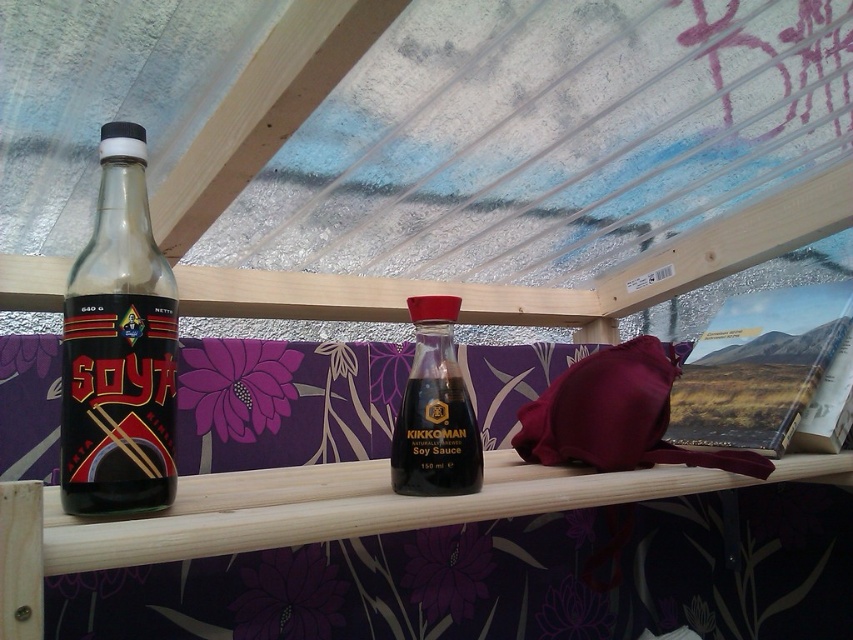
Question: Does matte glass soy sauce bottle at left have a greater width compared to dark brown glass bottle at center?

Choices:
 (A) yes
 (B) no

Answer: (A)

Question: Where is matte glass soy sauce bottle at left located in relation to dark brown glass bottle at center in the image?

Choices:
 (A) below
 (B) above

Answer: (B)

Question: Does matte glass soy sauce bottle at left appear on the right side of dark brown glass bottle at center?

Choices:
 (A) yes
 (B) no

Answer: (B)